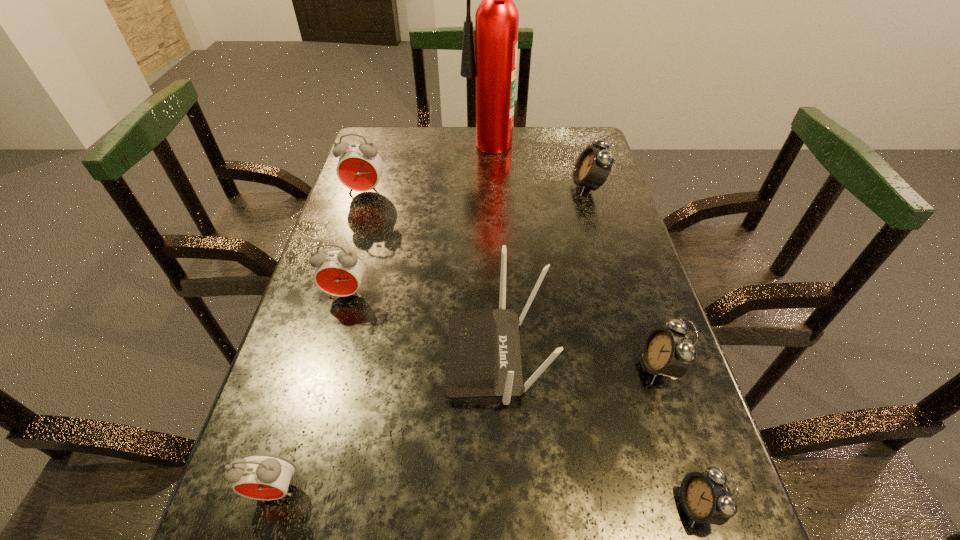
This screenshot has height=540, width=960. I want to click on free space located on the face of the biggest white alarm clock, so click(501, 187).

Identify the location of vacant region located on the face of the biggest white alarm clock. This screenshot has height=540, width=960. (540, 187).

Find the location of a particular element. free space located on the face of the biggest white alarm clock is located at coordinates (518, 187).

Where is `vacant space located 0.290m on the face of the second smallest red alarm clock`? The width and height of the screenshot is (960, 540). vacant space located 0.290m on the face of the second smallest red alarm clock is located at coordinates (306, 435).

The width and height of the screenshot is (960, 540). Identify the location of vacant space located 0.360m on the face of the second nearest white alarm clock. (448, 367).

I want to click on vacant space located 0.080m on the face of the second nearest white alarm clock, so click(x=596, y=367).

Locate an element on the screen. The image size is (960, 540). vacant space situated on the face of the second nearest white alarm clock is located at coordinates (464, 367).

The width and height of the screenshot is (960, 540). I want to click on free region located 0.150m on the face of the shortest alarm clock, so click(x=579, y=507).

Locate an element on the screen. vacant space located 0.160m on the face of the shortest alarm clock is located at coordinates (572, 507).

Find the location of a particular element. The image size is (960, 540). vacant space located on the face of the shortest alarm clock is located at coordinates (565, 507).